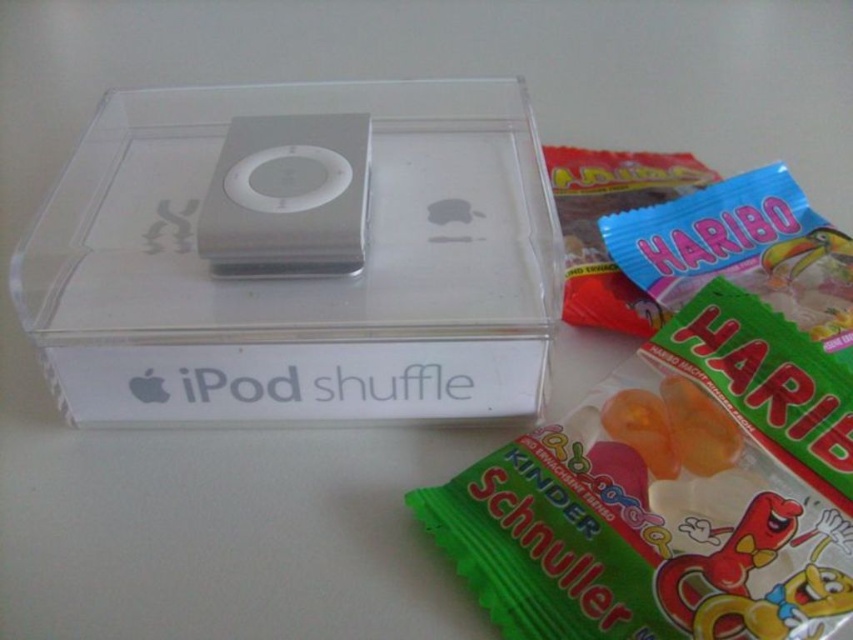
You are holding a camera and want to take a photo of the iPod shuffle box and the two Haribo candy packets. Based on their positions, which of the two points, point 1 at coordinates point (x=117, y=211) or point 2 at coordinates point (x=350, y=176), would be closer to the camera and thus more in focus if you focus on one of them?

Point 1 at coordinates point (x=117, y=211) is closer to the camera than point 2 at coordinates point (x=350, y=176), so focusing on point 1 would keep it more in focus.

You are trying to determine which of the two iPod shuffles in the clear plastic box is wider. The options are the clear plastic iPod shuffle at center and the sleek silver iPod shuffle at center. Which one has a greater width?

The clear plastic iPod shuffle at center has a greater width than the sleek silver iPod shuffle at center according to the description.